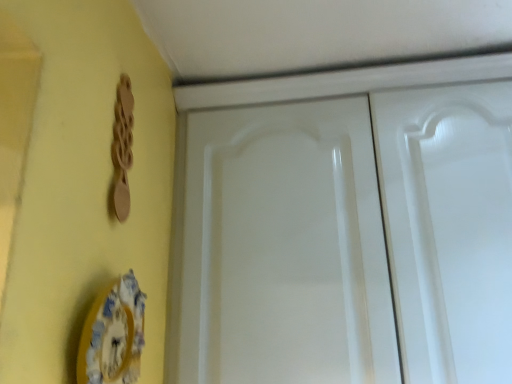
Question: From their relative heights in the image, would you say wooden spoon at upper left is taller or shorter than white glossy cabinet doors at center?

Choices:
 (A) tall
 (B) short

Answer: (B)

Question: Is wooden spoon at upper left wider or thinner than white glossy cabinet doors at center?

Choices:
 (A) wide
 (B) thin

Answer: (B)

Question: Which object is positioned farthest from the porcelain plate at lower left?

Choices:
 (A) wooden spoon at upper left
 (B) white glossy cabinet doors at center

Answer: (B)

Question: Which object is positioned closest to the white glossy cabinet doors at center?

Choices:
 (A) porcelain plate at lower left
 (B) wooden spoon at upper left

Answer: (B)